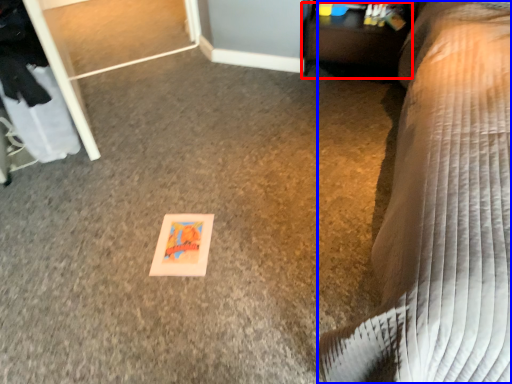
Question: Among these objects, which one is farthest to the camera, table (highlighted by a red box) or furniture (highlighted by a blue box)?

Choices:
 (A) table
 (B) furniture

Answer: (A)